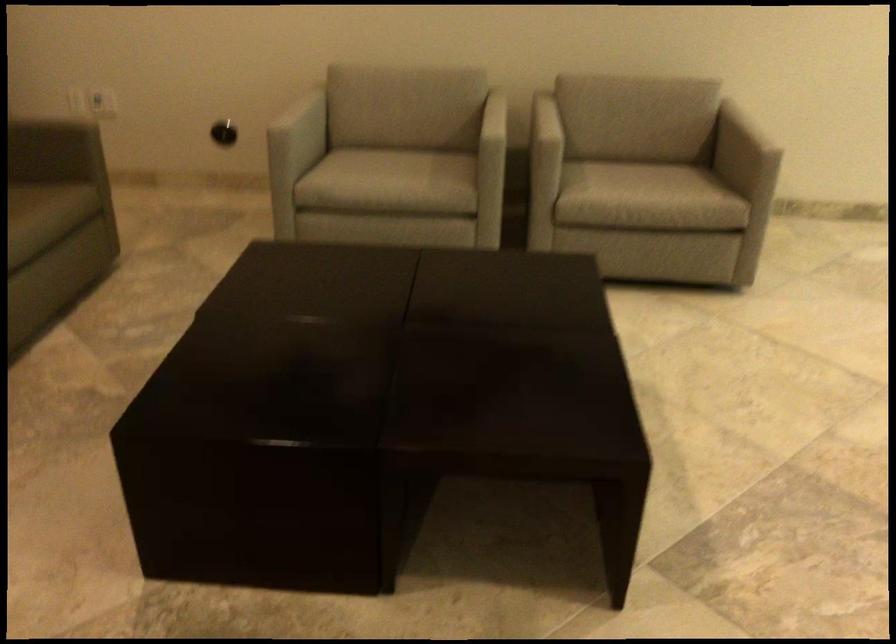
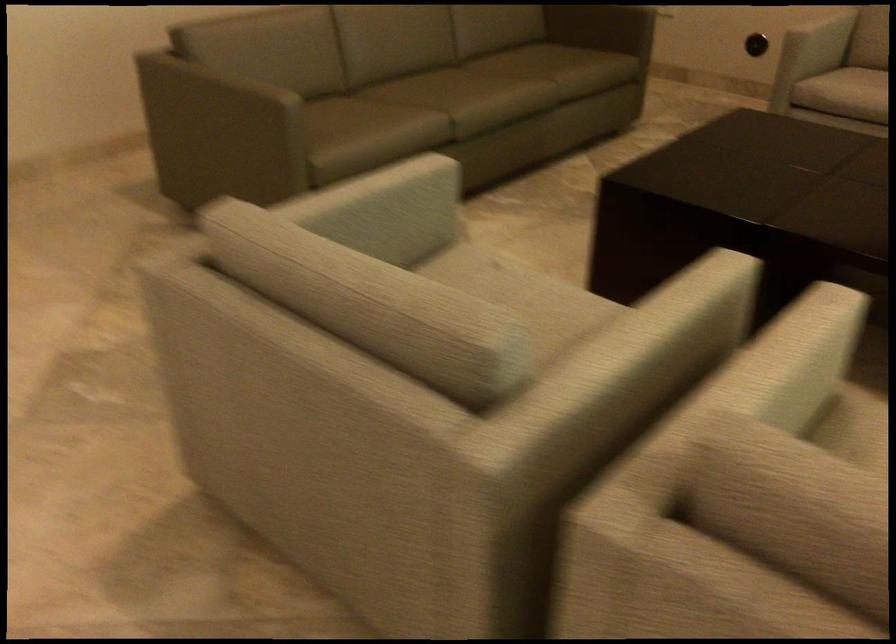
Where in the second image is the point corresponding to (306,120) from the first image?

(821, 35)